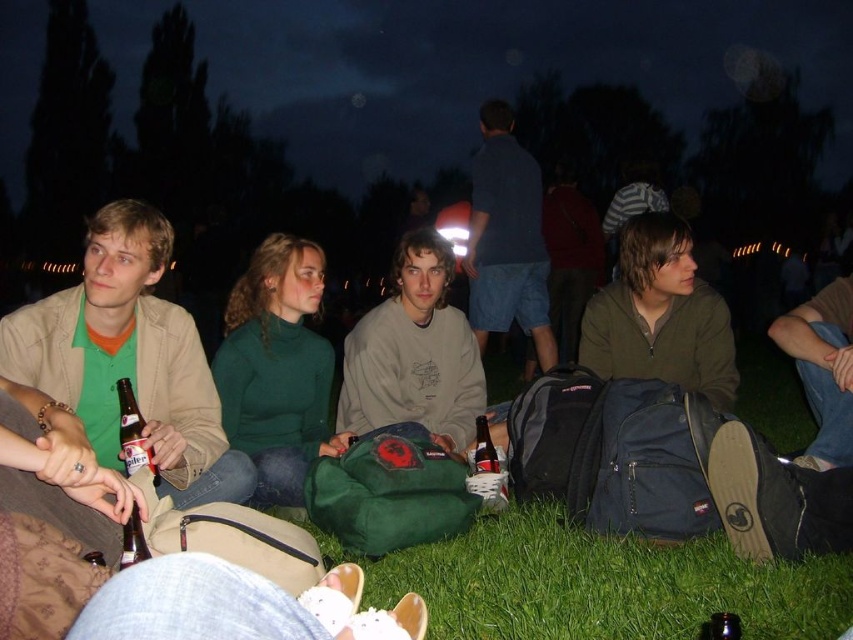
Is green grass at lower center above brown glass bottle at center?

Actually, green grass at lower center is below brown glass bottle at center.

Does green grass at lower center appear on the left side of brown glass bottle at center?

Incorrect, green grass at lower center is not on the left side of brown glass bottle at center.

Who is more forward, [314,531] or [477,440]?

Positioned in front is point [314,531].

Where is `green grass at lower center`? This screenshot has width=853, height=640. green grass at lower center is located at coordinates (601, 584).

Does green zip-up jacket at center have a smaller size compared to translucent glass bottle at lower left?

Incorrect, green zip-up jacket at center is not smaller in size than translucent glass bottle at lower left.

Which is behind, point (598, 371) or point (149, 554)?

Point (598, 371)

This screenshot has width=853, height=640. I want to click on green zip-up jacket at center, so click(660, 316).

Does light gray sweatshirt at center have a lesser height compared to brown glass bottle at center?

No, light gray sweatshirt at center is not shorter than brown glass bottle at center.

Is light gray sweatshirt at center smaller than brown glass bottle at center?

No.

Locate an element on the screen. The width and height of the screenshot is (853, 640). light gray sweatshirt at center is located at coordinates (415, 353).